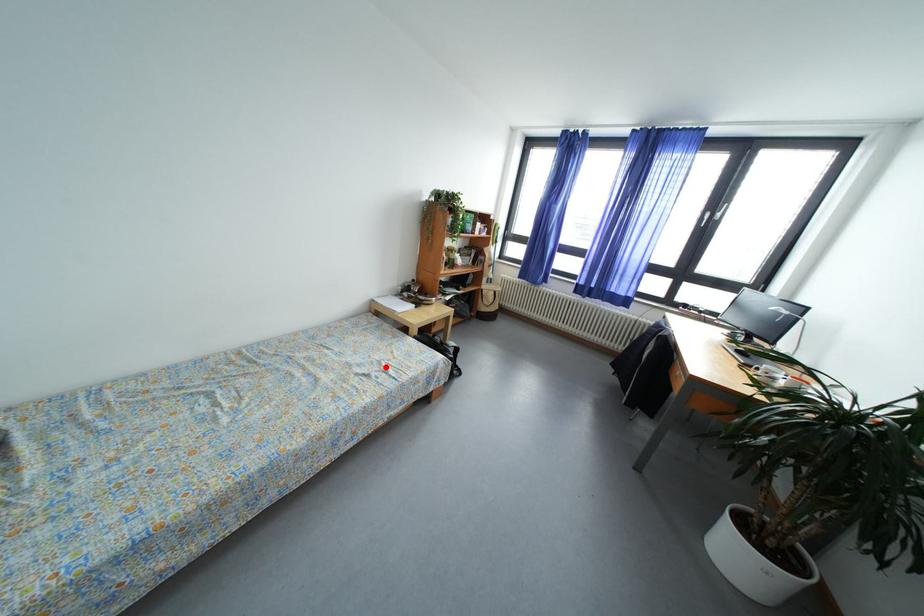
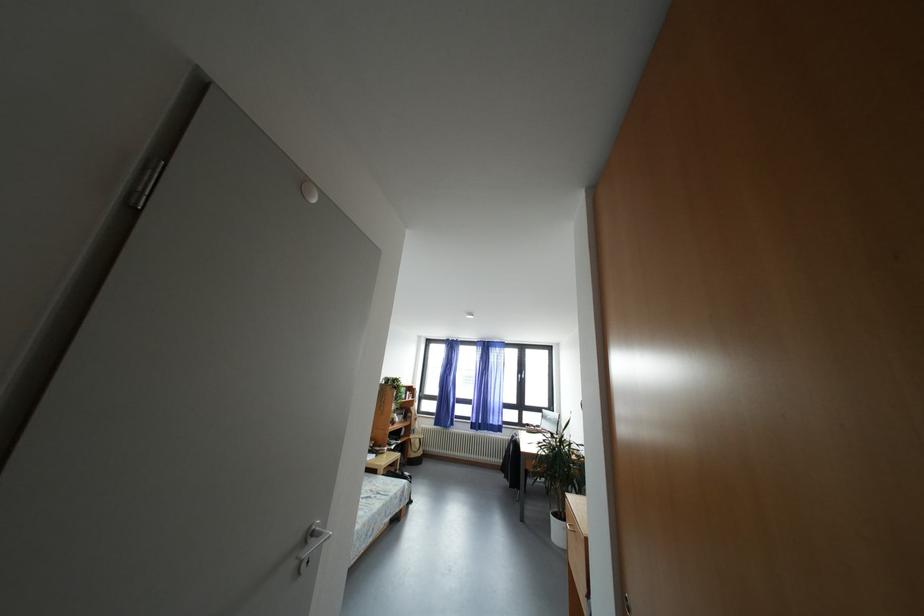
Locate, in the second image, the point that corresponds to the highlighted location in the first image.

(378, 496)